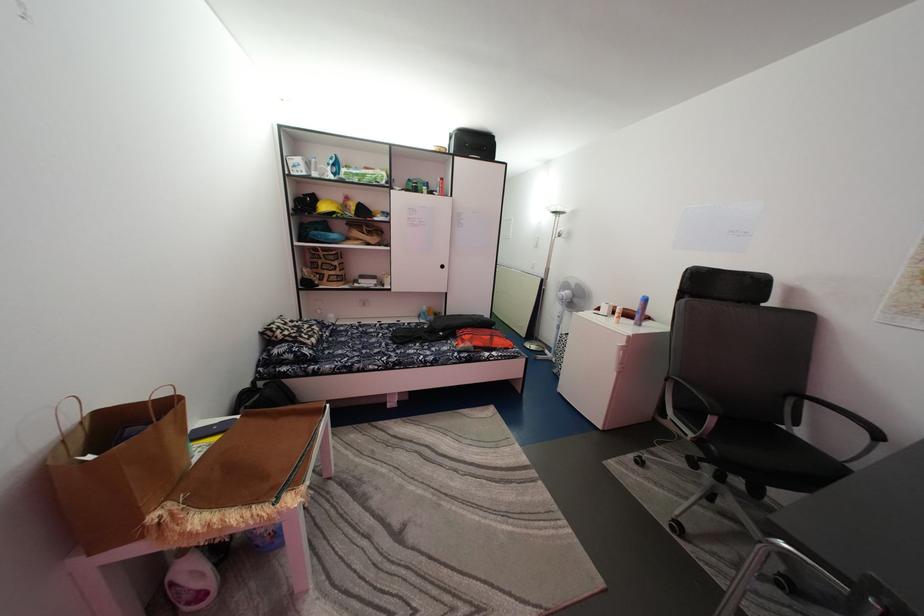
Describe the element at coordinates (852, 419) in the screenshot. I see `the black chair armrest` at that location.